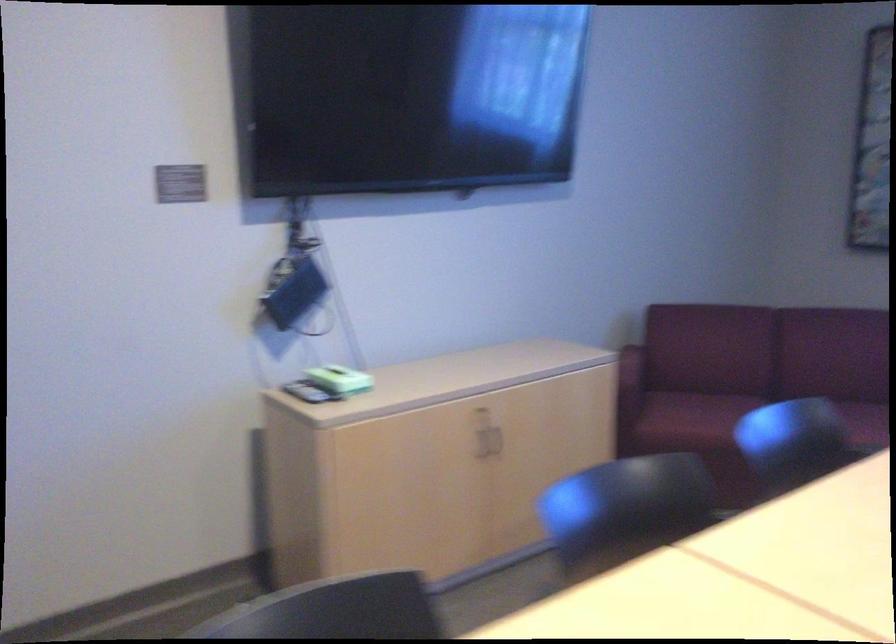
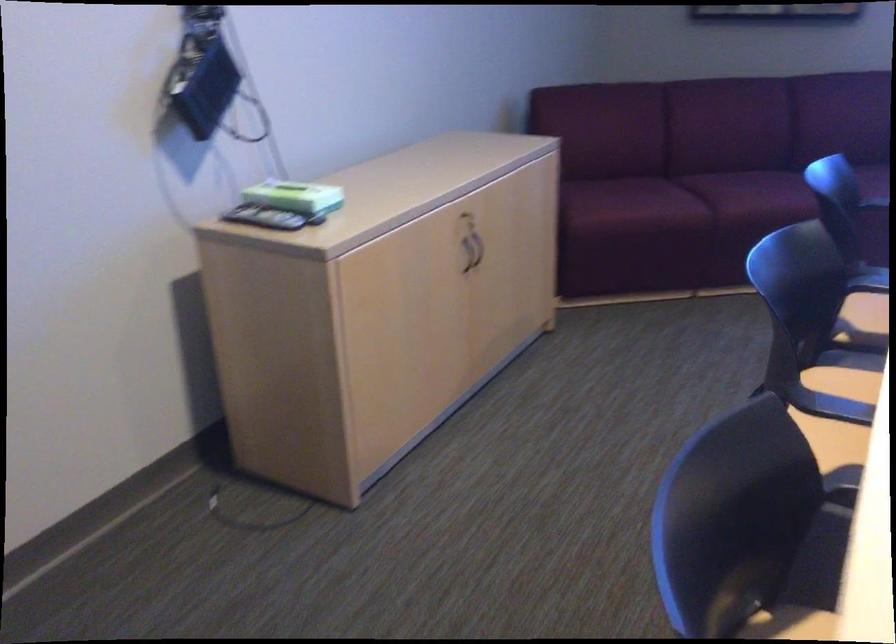
Find the pixel in the second image that matches the point at 328,375 in the first image.

(287, 196)